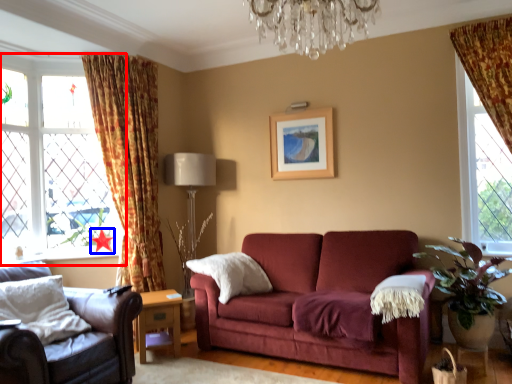
Question: Which of the following is the farthest to the observer, window (highlighted by a red box) or star (highlighted by a blue box)?

Choices:
 (A) window
 (B) star

Answer: (B)